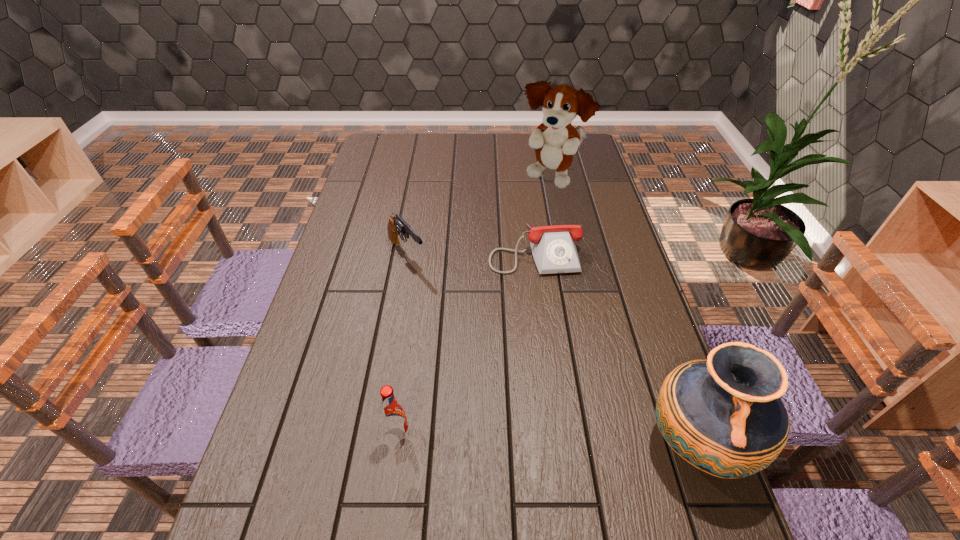
Where is `root beer`? root beer is located at coordinates (393, 416).

Locate an element on the screen. The height and width of the screenshot is (540, 960). pottery is located at coordinates (724, 416).

The height and width of the screenshot is (540, 960). I want to click on the shortest object, so click(x=554, y=251).

Find the location of a particular element. gun is located at coordinates (396, 225).

Locate an element on the screen. The image size is (960, 540). the tallest object is located at coordinates (556, 141).

This screenshot has width=960, height=540. What are the coordinates of `puppy` in the screenshot? It's located at (556, 141).

Locate an element on the screen. This screenshot has height=540, width=960. free spot located 0.370m on the back of the root beer is located at coordinates [x=417, y=299].

Identify the location of free space located on the left of the fourth shortest object. The width and height of the screenshot is (960, 540). (572, 444).

Identify the location of free space located 0.250m on the dial of the shortest object. (559, 347).

The width and height of the screenshot is (960, 540). Identify the location of vacant region located 0.180m on the dial of the shortest object. (554, 325).